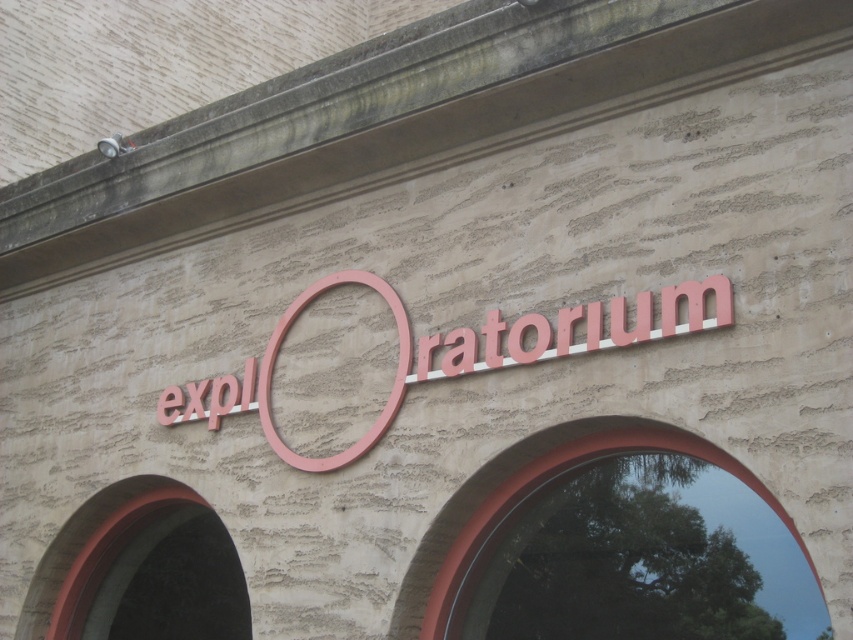
Question: Where is pink matte sign at center located in relation to smooth glass window at center in the image?

Choices:
 (A) below
 (B) above

Answer: (B)

Question: In this image, where is pink matte sign at center located relative to smooth red arch at lower left?

Choices:
 (A) left
 (B) right

Answer: (B)

Question: Among these objects, which one is nearest to the camera?

Choices:
 (A) smooth red arch at lower left
 (B) smooth glass window at center

Answer: (B)

Question: Is smooth red arch at lower left positioned before smooth glass window at center?

Choices:
 (A) yes
 (B) no

Answer: (B)

Question: Which object is positioned farthest from the smooth red arch at lower left?

Choices:
 (A) pink matte sign at center
 (B) smooth glass window at center

Answer: (B)

Question: Which point is farther from the camera taking this photo?

Choices:
 (A) (148, 595)
 (B) (561, 342)

Answer: (A)